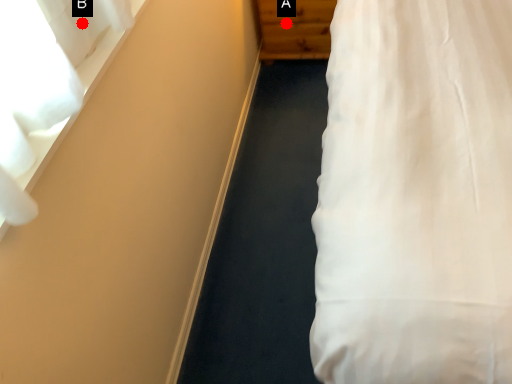
Question: Two points are circled on the image, labeled by A and B beside each circle. Which point is farther from the camera taking this photo?

Choices:
 (A) A is further
 (B) B is further

Answer: (A)